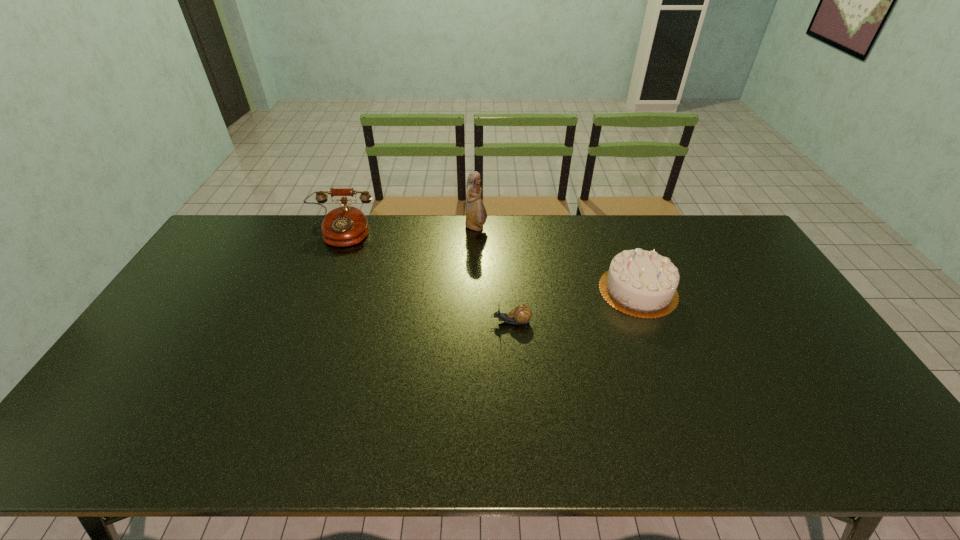
Where is `vacant point located 0.400m on the front-facing side of the escargot`? The height and width of the screenshot is (540, 960). vacant point located 0.400m on the front-facing side of the escargot is located at coordinates (354, 322).

Locate an element on the screen. The width and height of the screenshot is (960, 540). blank area located 0.330m on the front-facing side of the escargot is located at coordinates (377, 322).

I want to click on figurine at the far edge, so [x=476, y=215].

What are the coordinates of `telephone that is at the far edge` in the screenshot? It's located at (344, 226).

Find the location of a particular element. The image size is (960, 540). vacant space at the far edge is located at coordinates (384, 235).

Where is `free spot at the near edge of the desktop`? The image size is (960, 540). free spot at the near edge of the desktop is located at coordinates (619, 433).

The height and width of the screenshot is (540, 960). What are the coordinates of `vacant area at the left edge` in the screenshot? It's located at (184, 323).

This screenshot has width=960, height=540. I want to click on free space at the right edge of the desktop, so click(x=831, y=409).

Identify the location of blank region between the rightmost object and the escargot. This screenshot has height=540, width=960. (574, 306).

This screenshot has height=540, width=960. In order to click on free spot between the leftmost object and the tallest object in this screenshot , I will do `click(408, 231)`.